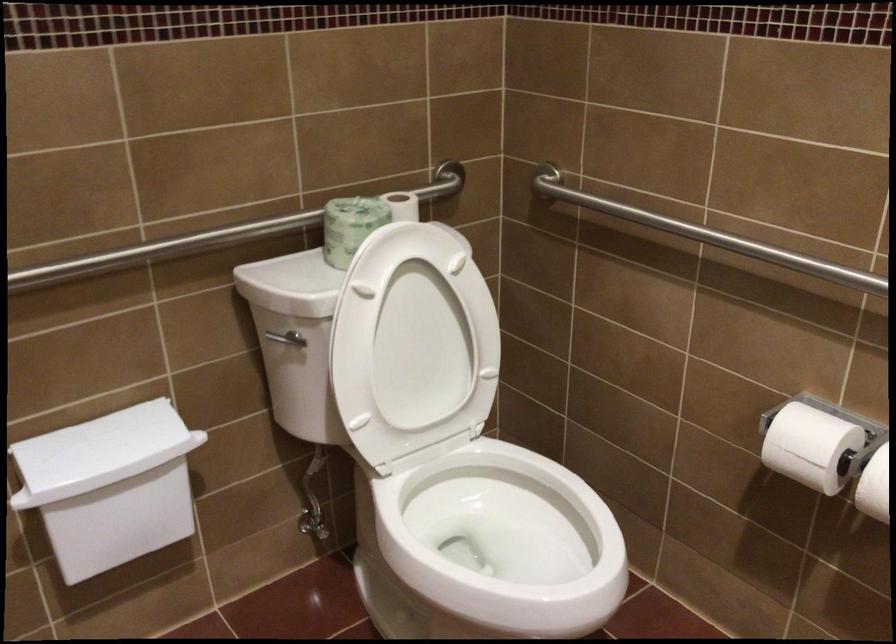
Question: The camera is either moving clockwise (left) or counter-clockwise (right) around the object. The first image is from the beginning of the video and the second image is from the end. Is the camera moving left or right when shooting the video?

Choices:
 (A) Left
 (B) Right

Answer: (B)